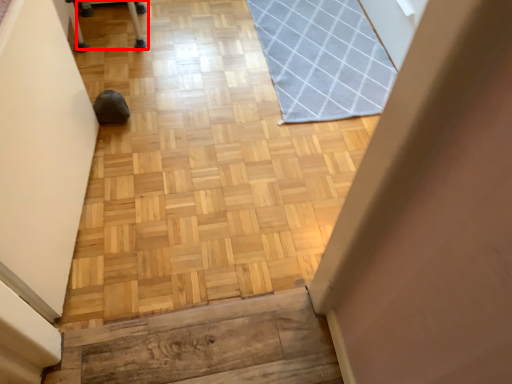
Question: From the image's perspective, where is furniture (annotated by the red box) located in relation to mat in the image?

Choices:
 (A) above
 (B) below

Answer: (A)